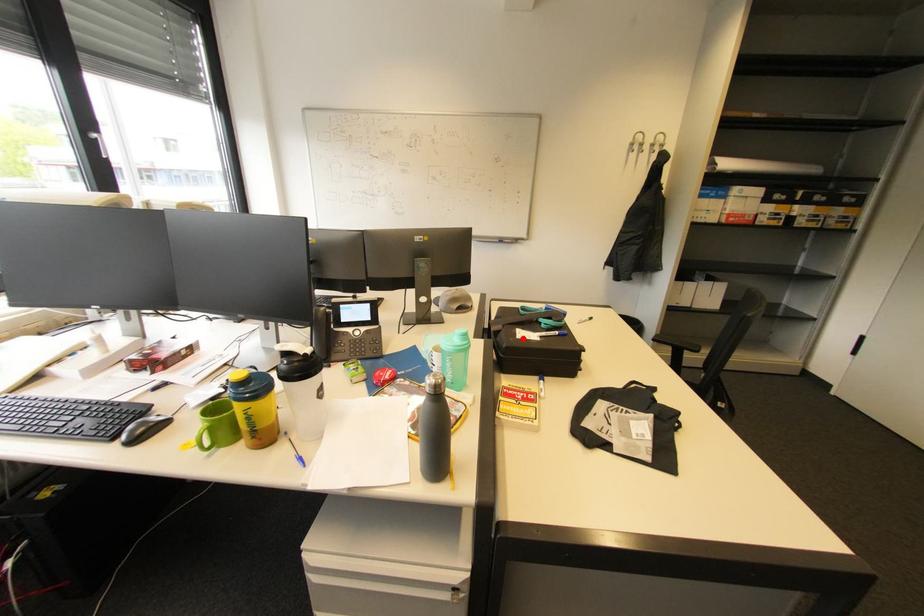
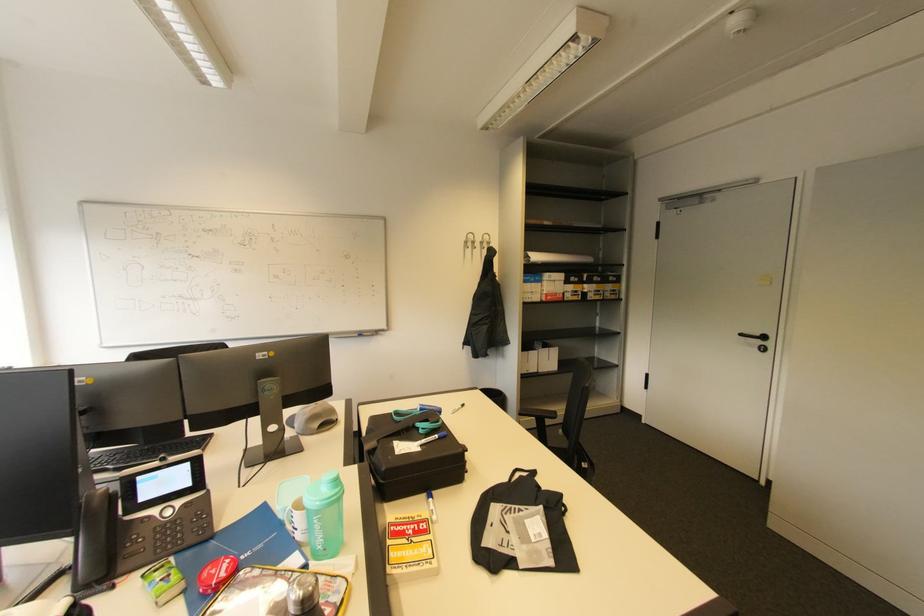
Locate, in the second image, the point that corresponds to the highlighted location in the first image.

(402, 455)